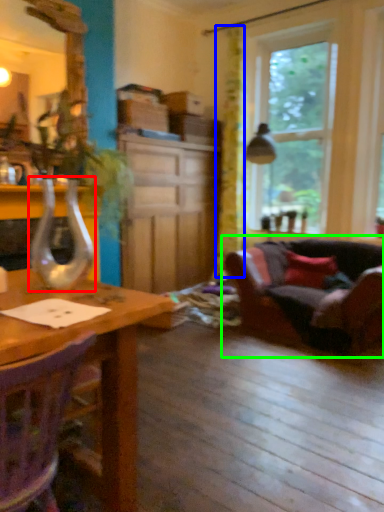
Question: Considering the real-world distances, which object is farthest from glass vase (highlighted by a red box)? curtain (highlighted by a blue box) or studio couch (highlighted by a green box)?

Choices:
 (A) curtain
 (B) studio couch

Answer: (A)